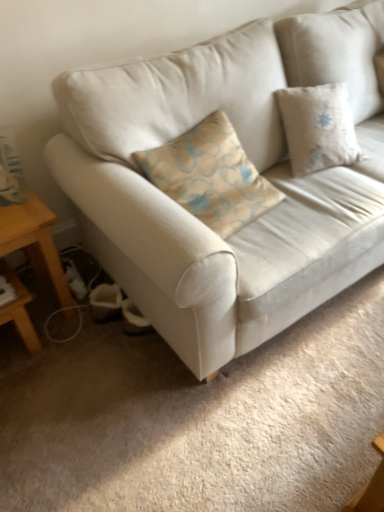
Where is `vacant area that is in front of wooden table at lower left`? The height and width of the screenshot is (512, 384). vacant area that is in front of wooden table at lower left is located at coordinates (51, 380).